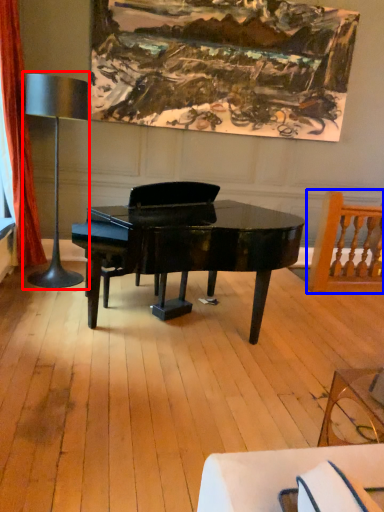
Question: Which object is closer to the camera taking this photo, table lamp (highlighted by a red box) or chair (highlighted by a blue box)?

Choices:
 (A) table lamp
 (B) chair

Answer: (A)